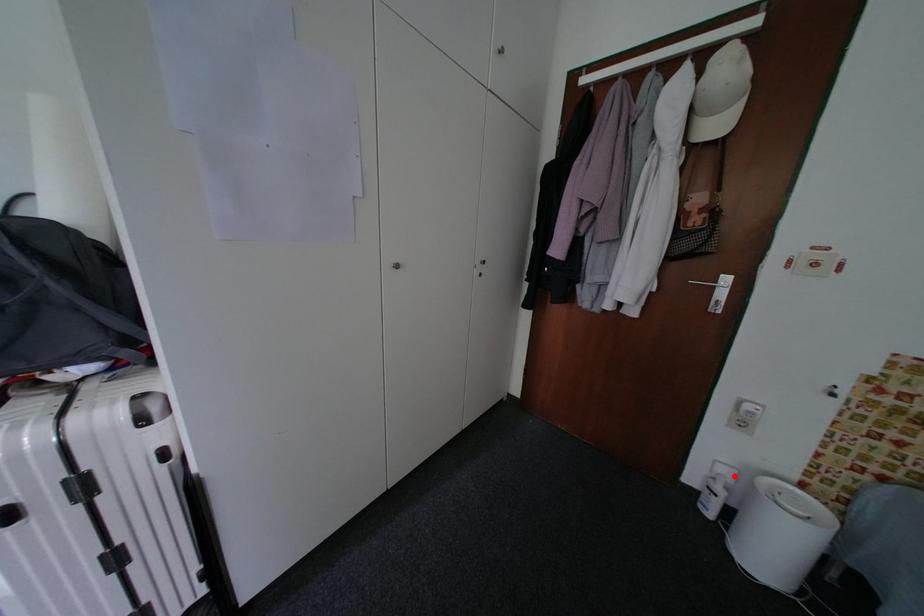
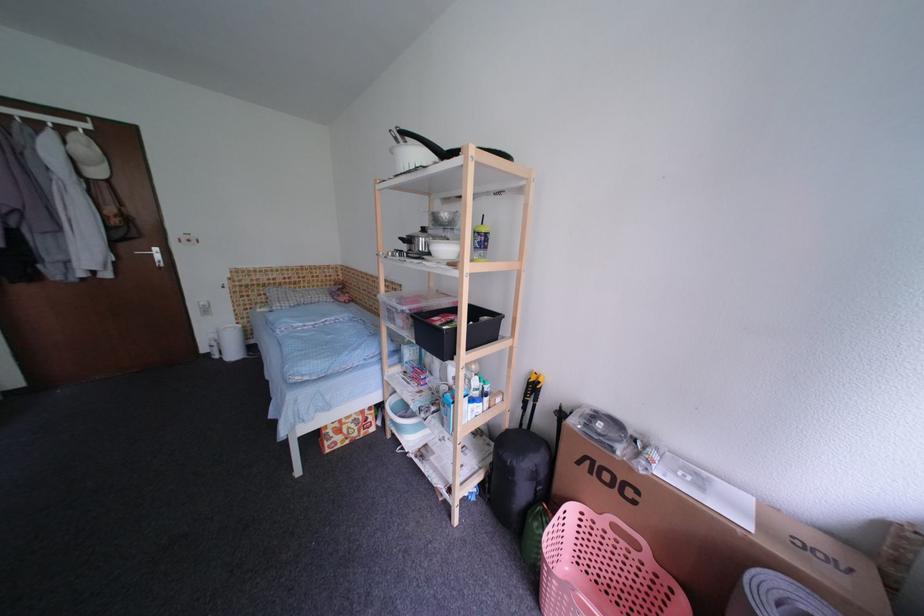
The point at the highlighted location is marked in the first image. Where is the corresponding point in the second image?

(222, 338)